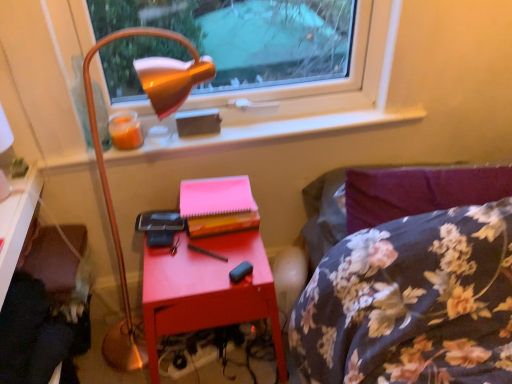
Identify the location of free spot above pink paper at center (from a real-world perspective). Image resolution: width=512 pixels, height=384 pixels. (214, 190).